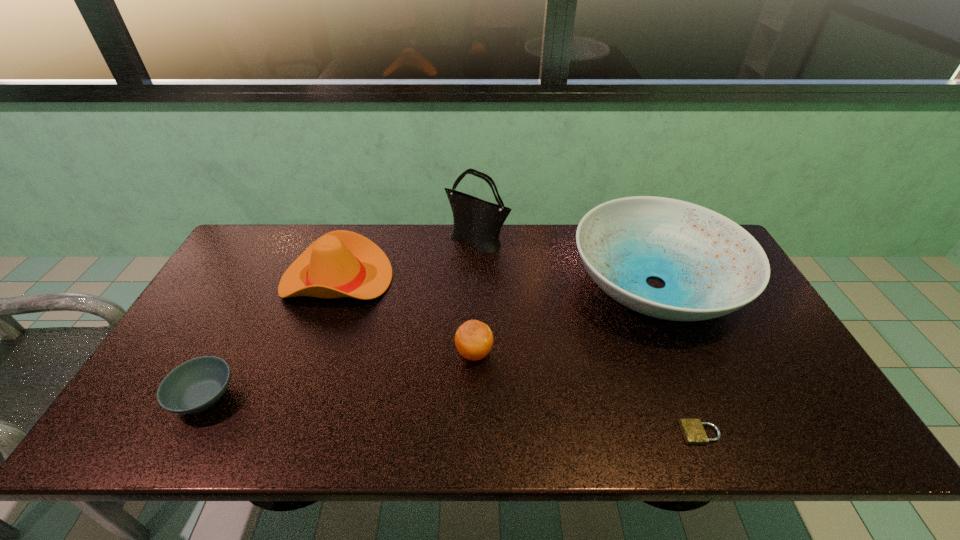
In order to click on free location that satisfies the following two spatial constraints: 1. on the front side of the cowboy hat; 2. on the right side of the fourth tallest object in this screenshot , I will do `click(310, 353)`.

In order to click on free spot that satisfies the following two spatial constraints: 1. on the front side of the cowboy hat; 2. on the right side of the orange in this screenshot , I will do `click(310, 353)`.

Locate an element on the screen. The width and height of the screenshot is (960, 540). vacant space that satisfies the following two spatial constraints: 1. on the back side of the third shortest object; 2. on the right side of the dish is located at coordinates (475, 284).

Locate an element on the screen. The image size is (960, 540). free space that satisfies the following two spatial constraints: 1. on the back side of the soup bowl; 2. on the right side of the cowboy hat is located at coordinates (266, 279).